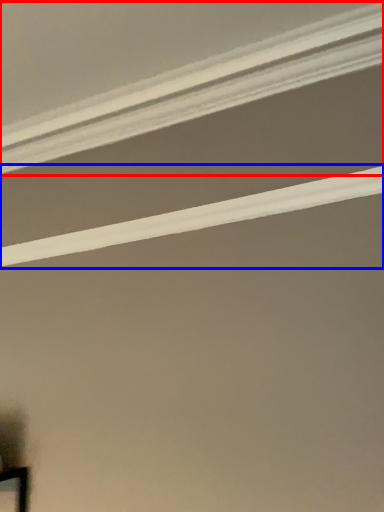
Question: Which point is further to the camera, strip (highlighted by a red box) or strip (highlighted by a blue box)?

Choices:
 (A) strip
 (B) strip

Answer: (B)